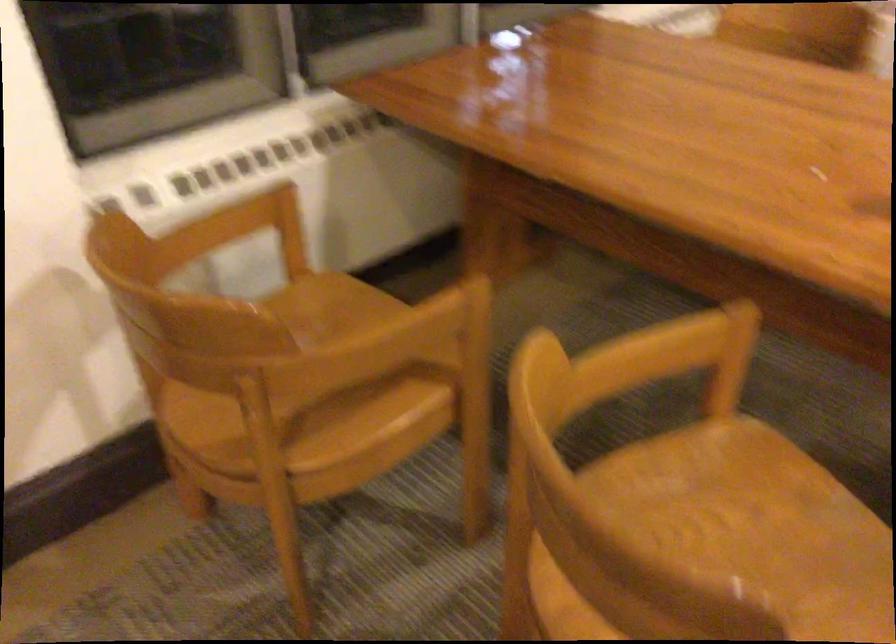
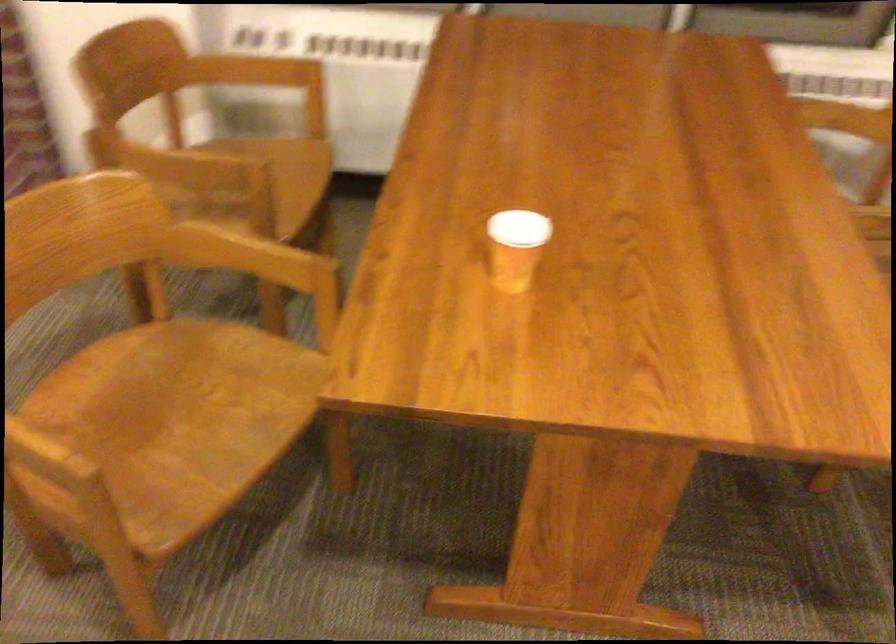
Locate, in the second image, the point that corresponds to [393,336] in the first image.

(169, 163)